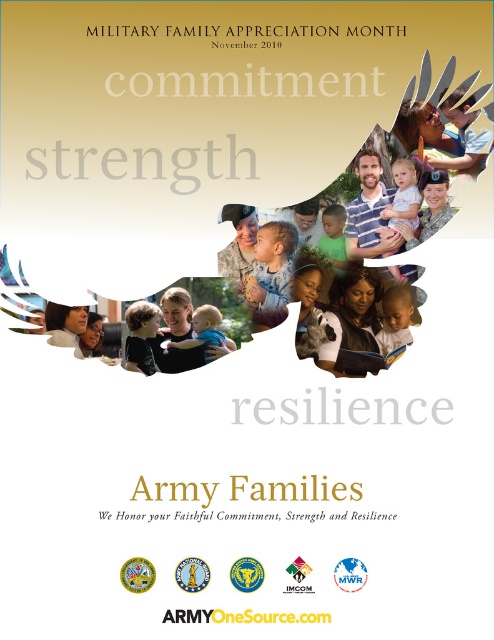
Between smooth skin child at center and soft beige baby at center, which one has more height?

smooth skin child at center

Can you confirm if smooth skin child at center is positioned to the right of soft beige baby at center?

Yes, smooth skin child at center is to the right of soft beige baby at center.

Is point (257, 253) closer to viewer compared to point (214, 324)?

Yes.

Where is `smooth skin child at center`? The image size is (494, 640). smooth skin child at center is located at coordinates (271, 269).

Is light brown skin at center wider than pink fabric dress at center?

Correct, the width of light brown skin at center exceeds that of pink fabric dress at center.

Does light brown skin at center have a larger size compared to pink fabric dress at center?

Incorrect, light brown skin at center is not larger than pink fabric dress at center.

Describe the element at coordinates (397, 317) in the screenshot. I see `light brown skin at center` at that location.

Image resolution: width=494 pixels, height=640 pixels. Identify the location of light brown skin at center. (397, 317).

This screenshot has height=640, width=494. What do you see at coordinates (271, 269) in the screenshot?
I see `smooth skin child at center` at bounding box center [271, 269].

Is point (249, 285) positioned after point (402, 188)?

No, it is in front of (402, 188).

This screenshot has height=640, width=494. Identify the location of smooth skin child at center. (271, 269).